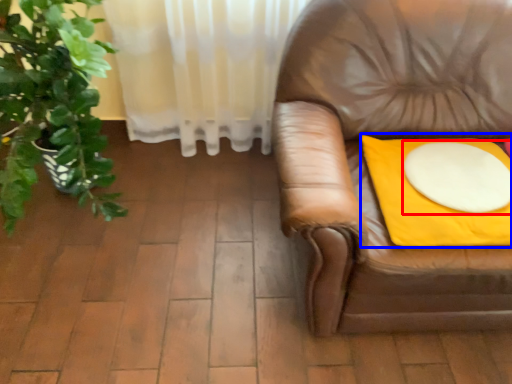
Question: Which point is further to the camera, round table (highlighted by a red box) or blanket (highlighted by a blue box)?

Choices:
 (A) round table
 (B) blanket

Answer: (A)